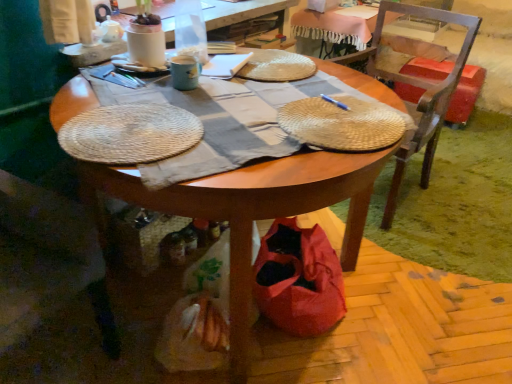
Locate an element on the screen. The width and height of the screenshot is (512, 384). vacant space that is in between matte ceramic mug at upper center and blue metallic pen at center is located at coordinates (260, 91).